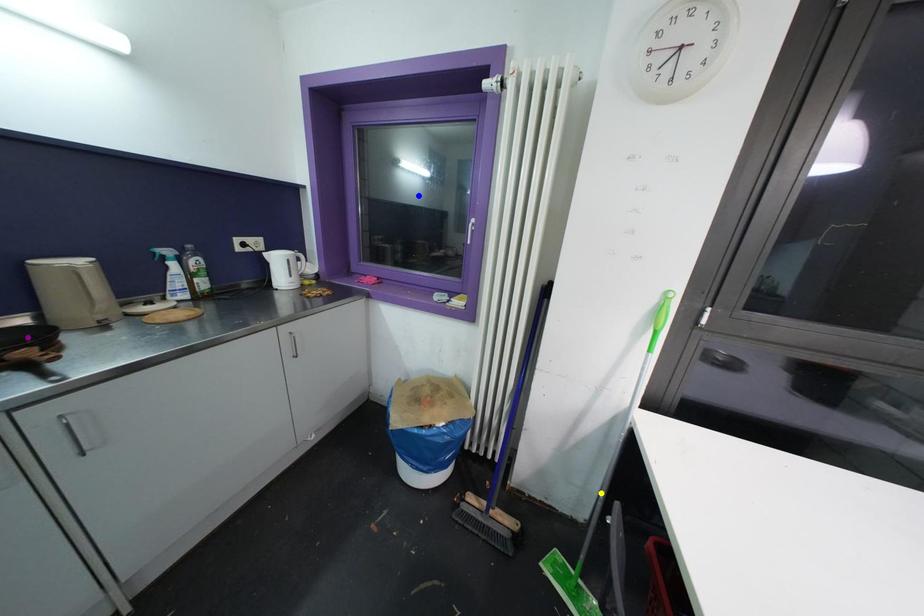
Order these from farthest to nearest:
purple point | yellow point | blue point

1. blue point
2. yellow point
3. purple point